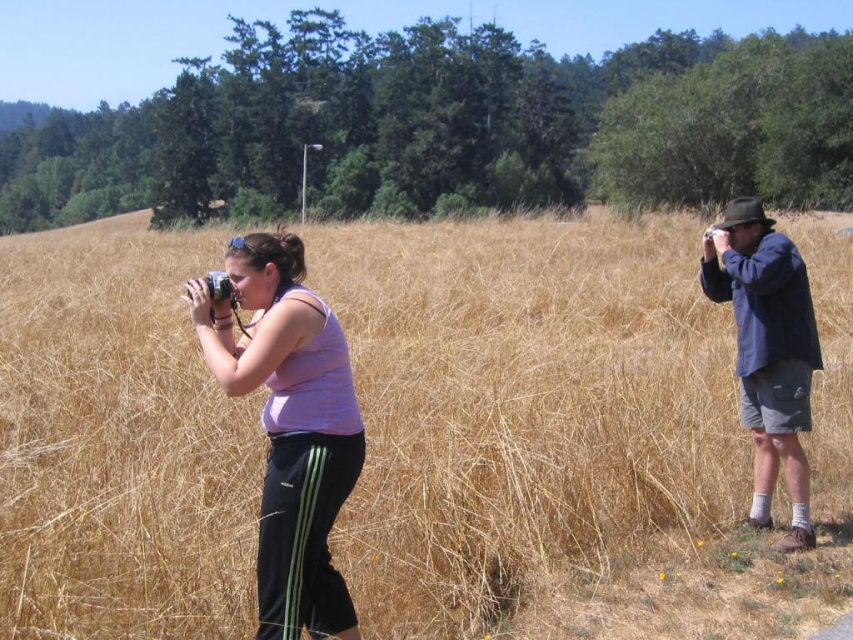
You are a photographer trying to decide which subject to focus on. The scene has two people with the pink fabric tank top at center and the blue denim jacket at right. Which clothing item is bigger in size?

The pink fabric tank top at center is larger in size compared to the blue denim jacket at right.